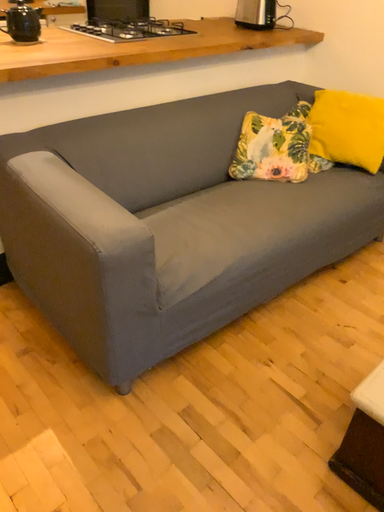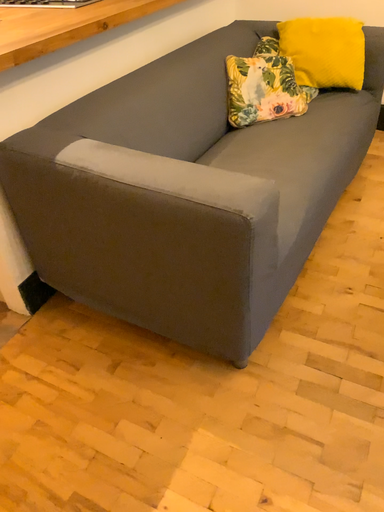
Question: Which way did the camera rotate in the video?

Choices:
 (A) rotated left
 (B) rotated right

Answer: (B)